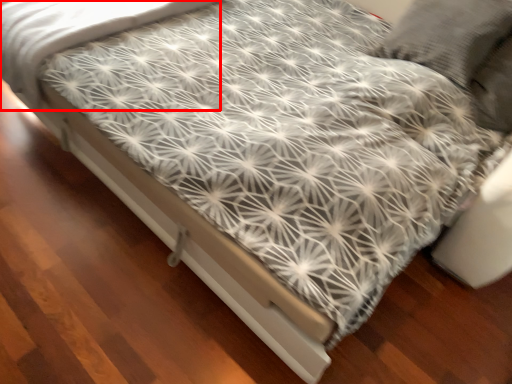
Question: Considering the relative positions of sheet (annotated by the red box) and bed frame in the image provided, where is sheet (annotated by the red box) located with respect to the staircase?

Choices:
 (A) right
 (B) left

Answer: (B)